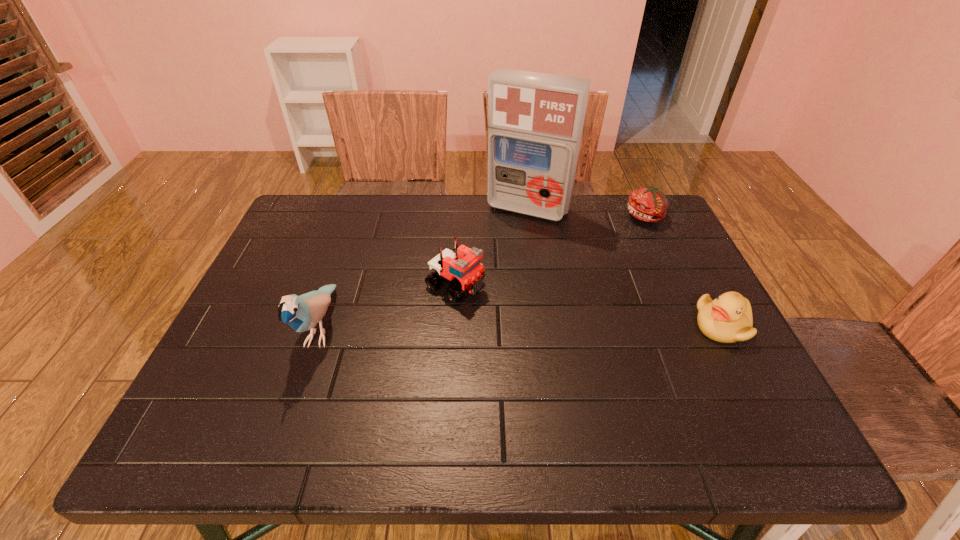
What are the coordinates of `free region located on the beak of the duckling` in the screenshot? It's located at (674, 326).

This screenshot has width=960, height=540. I want to click on vacant point located on the front-facing side of the tomato, so click(x=592, y=280).

At what (x,y) coordinates should I click in order to perform the action: click on vacant space located on the front-facing side of the tomato. Please return your answer as a coordinate pair (x, y). The image size is (960, 540). Looking at the image, I should click on (590, 282).

In order to click on vacant region located on the front-facing side of the tomato in this screenshot , I will do `click(620, 247)`.

At what (x,y) coordinates should I click in order to perform the action: click on free space located 0.390m on the front-facing side of the third shortest object. Please return your answer as a coordinate pair (x, y). Image resolution: width=960 pixels, height=540 pixels. Looking at the image, I should click on (627, 379).

The width and height of the screenshot is (960, 540). Identify the location of vacant space positioned on the front-facing side of the third shortest object. (584, 355).

Where is `free region located 0.310m on the front-facing side of the third shortest object`? free region located 0.310m on the front-facing side of the third shortest object is located at coordinates (592, 360).

Image resolution: width=960 pixels, height=540 pixels. I want to click on free point located 0.110m on the front-facing side of the tallest object, so click(x=502, y=245).

In order to click on vacant area situated on the front-facing side of the tallest object in this screenshot , I will do `click(486, 274)`.

What are the coordinates of `vacant space located on the front-facing side of the tallest object` in the screenshot? It's located at (503, 244).